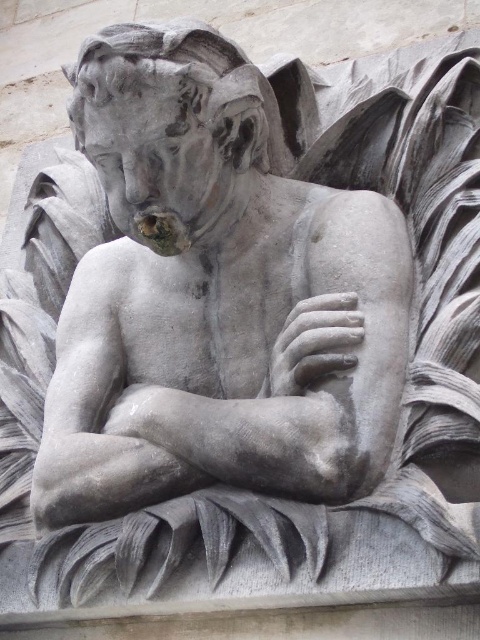
Between gray stone statue at center and gray stone hand at center, which one has more height?

gray stone statue at center

Does gray stone statue at center have a greater height compared to gray stone hand at center?

Yes.

Describe the element at coordinates (216, 298) in the screenshot. I see `gray stone statue at center` at that location.

The image size is (480, 640). In order to click on gray stone statue at center in this screenshot , I will do `click(216, 298)`.